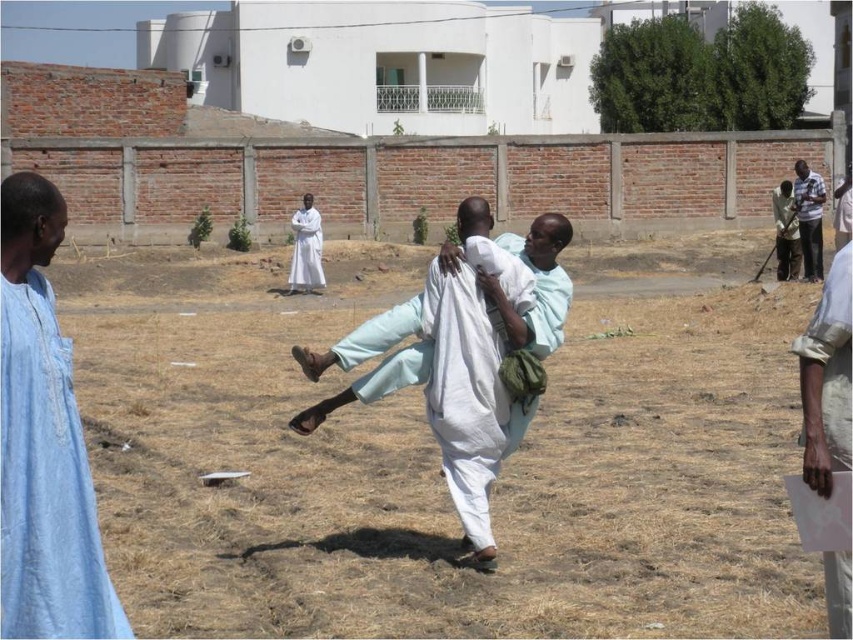
Question: Considering the relative positions of white matte robe at center and dark green fabric at right in the image provided, where is white matte robe at center located with respect to dark green fabric at right?

Choices:
 (A) left
 (B) right

Answer: (A)

Question: Among these points, which one is nearest to the camera?

Choices:
 (A) (817, 451)
 (B) (807, 177)

Answer: (A)

Question: From the image, what is the correct spatial relationship of light blue cotton robe at left in relation to striped cotton shirt at right?

Choices:
 (A) below
 (B) above

Answer: (A)

Question: Does light beige fabric hand at right appear on the left side of white matte robe at center?

Choices:
 (A) no
 (B) yes

Answer: (A)

Question: Which object appears farthest from the camera in this image?

Choices:
 (A) light blue cotton robe at left
 (B) white cotton cloth at center
 (C) striped cotton shirt at right
 (D) light beige fabric hand at right

Answer: (C)

Question: Which point is farther from the camera taking this photo?

Choices:
 (A) (804, 376)
 (B) (67, 355)

Answer: (A)